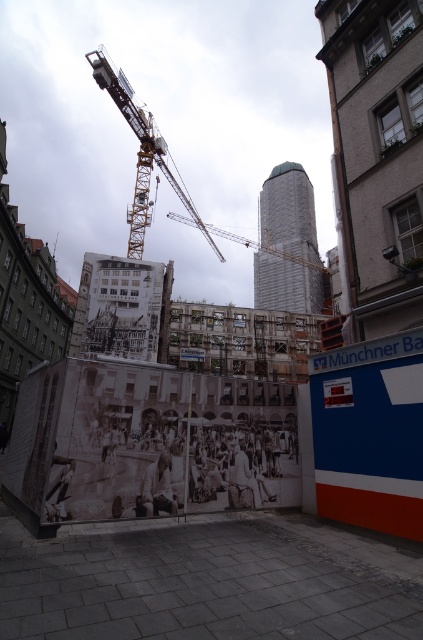
You are a safety inspector evaluating the construction site. You notice the yellow metallic crane at upper left and the white fabric construction worker at lower center. Which object is wider?

The yellow metallic crane at upper left is wider than the white fabric construction worker at lower center.

You are a delivery drone with a package that needs to be delivered to the construction site. The drone has a maximum flight range of 50 meters. Can the drone safely fly from its current position, which is near the yellow metallic crane at upper left, to the delivery point near the white fabric construction worker at lower center without exceeding its range?

The distance between the yellow metallic crane at upper left and the white fabric construction worker at lower center is 49.00 meters. Since the drone has a maximum range of 50 meters, it can safely make the trip without exceeding its limit.

You are an inspector standing at the construction site. You need to locate the point at coordinates (172, 160). Where exactly is this point located?

The point at coordinates (172, 160) is located on the yellow metallic crane at upper left.